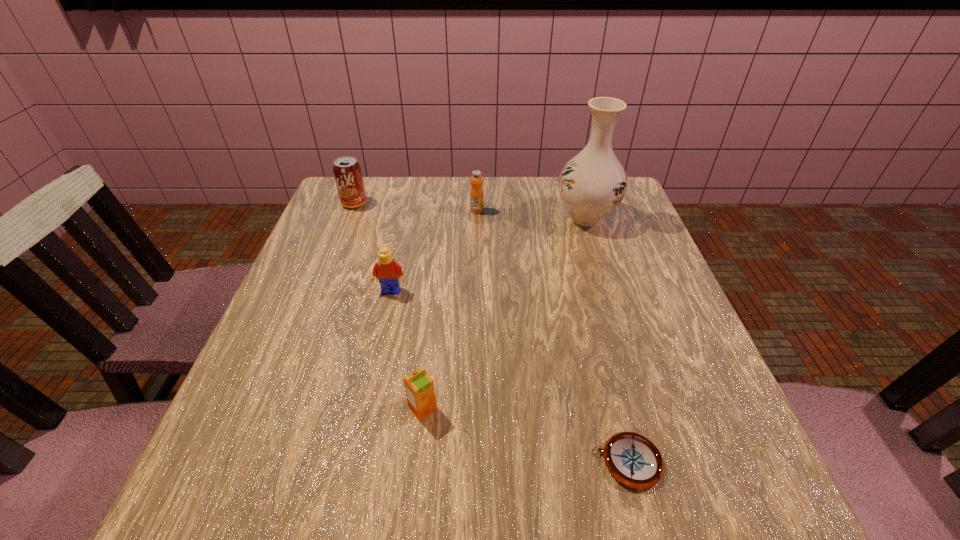
This screenshot has height=540, width=960. In order to click on vacant region located on the front of the vase in this screenshot , I will do `click(611, 295)`.

The height and width of the screenshot is (540, 960). In order to click on vacant space located 0.350m on the front of the soda can in this screenshot , I will do `click(316, 303)`.

Image resolution: width=960 pixels, height=540 pixels. I want to click on free space located 0.210m on the front label of the taller orange juice, so click(x=476, y=266).

This screenshot has height=540, width=960. In order to click on vacant space located on the front-facing side of the third nearest object in this screenshot , I will do `click(366, 407)`.

At what (x,y) coordinates should I click in order to perform the action: click on vacant region located 0.120m on the right of the third object from left to right. Please return your answer as a coordinate pair (x, y). Looking at the image, I should click on (509, 408).

The height and width of the screenshot is (540, 960). Identify the location of vacant region located on the back of the compass. (593, 327).

Where is `vase located at the far edge`? This screenshot has height=540, width=960. vase located at the far edge is located at coordinates (592, 183).

The image size is (960, 540). I want to click on soda can present at the far edge, so click(347, 171).

Locate an element on the screen. The width and height of the screenshot is (960, 540). orange juice at the far edge is located at coordinates (476, 193).

You are a GUI agent. You are given a task and a screenshot of the screen. Output one action in this format:
    pyautogui.click(x=<x>, y=<y>)
    Task: Click on the object that is at the near edge
    
    Given the screenshot: What is the action you would take?
    pyautogui.click(x=632, y=459)